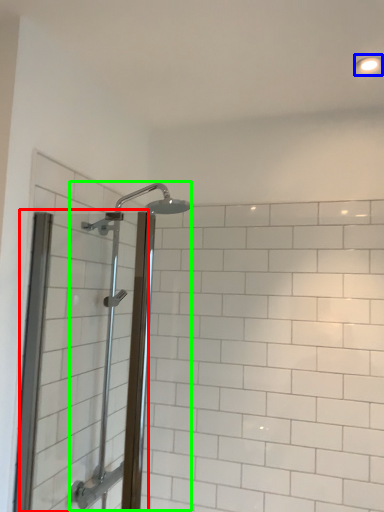
Question: Which object is the closest to the screen door (highlighted by a red box)? Choose among these: light fixture (highlighted by a blue box) or shower (highlighted by a green box).

Choices:
 (A) light fixture
 (B) shower

Answer: (B)